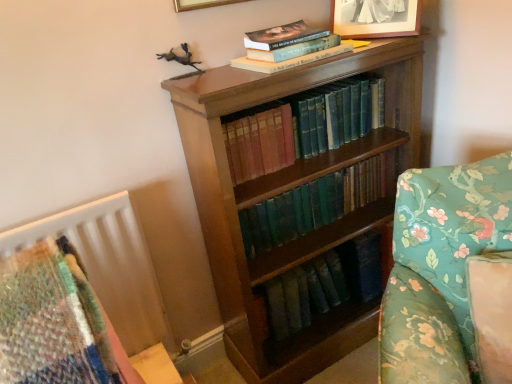
Question: Does hardcover book at upper center, which is the first book in top-to-bottom order, appear on the right side of floral fabric sofa at right?

Choices:
 (A) no
 (B) yes

Answer: (A)

Question: Is hardcover book at upper center, positioned as the third book in bottom-to-top order, positioned beyond the bounds of floral fabric sofa at right?

Choices:
 (A) no
 (B) yes

Answer: (B)

Question: Is hardcover book at upper center, positioned as the third book in bottom-to-top order, touching floral fabric sofa at right?

Choices:
 (A) no
 (B) yes

Answer: (A)

Question: Does hardcover book at upper center, positioned as the third book in bottom-to-top order, have a lesser width compared to floral fabric sofa at right?

Choices:
 (A) yes
 (B) no

Answer: (A)

Question: Can you confirm if hardcover book at upper center, which is the first book in top-to-bottom order, is positioned to the left of floral fabric sofa at right?

Choices:
 (A) yes
 (B) no

Answer: (A)

Question: Does hardcover book at upper center, which is the first book in top-to-bottom order, contain floral fabric sofa at right?

Choices:
 (A) yes
 (B) no

Answer: (B)

Question: Can you confirm if matte silver picture frame at upper center is taller than floral fabric sofa at right?

Choices:
 (A) yes
 (B) no

Answer: (B)

Question: Is floral fabric sofa at right completely or partially inside matte silver picture frame at upper center?

Choices:
 (A) yes
 (B) no

Answer: (B)

Question: Is matte silver picture frame at upper center to the right of floral fabric sofa at right from the viewer's perspective?

Choices:
 (A) yes
 (B) no

Answer: (B)

Question: From a real-world perspective, is matte silver picture frame at upper center under floral fabric sofa at right?

Choices:
 (A) no
 (B) yes

Answer: (A)

Question: Could you tell me if matte silver picture frame at upper center is turned towards floral fabric sofa at right?

Choices:
 (A) yes
 (B) no

Answer: (B)

Question: Is matte silver picture frame at upper center far from floral fabric sofa at right?

Choices:
 (A) yes
 (B) no

Answer: (B)

Question: Is green leather book at center, arranged as the 3th book when viewed from the top, not within floral fabric sofa at right?

Choices:
 (A) no
 (B) yes

Answer: (B)